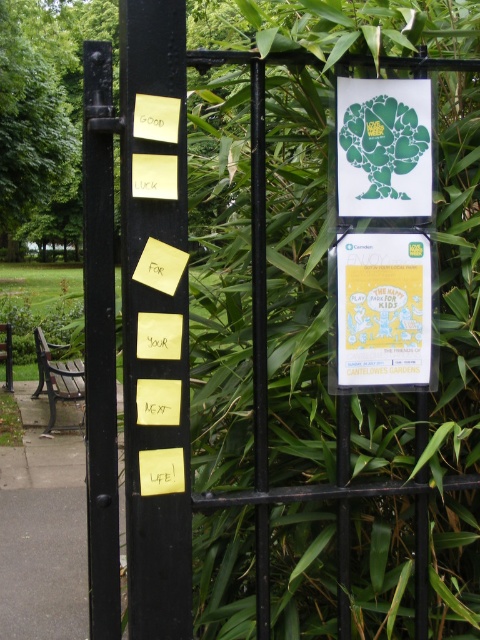
Based on the photo, who is taller, wooden bench at lower left or wooden bench at left?

Standing taller between the two is wooden bench at lower left.

Based on the photo, does wooden bench at lower left appear on the left side of wooden bench at left?

Incorrect, wooden bench at lower left is not on the left side of wooden bench at left.

Is point (41, 355) more distant than point (1, 353)?

No, it is not.

The image size is (480, 640). Identify the location of wooden bench at lower left. click(x=57, y=376).

Between black metal post at left and matte paper poster at upper right, which one has more height?

black metal post at left

Does black metal post at left have a lesser height compared to matte paper poster at upper right?

No.

Is point (84, 220) more distant than point (402, 355)?

Yes, it is.

You are a GUI agent. You are given a task and a screenshot of the screen. Output one action in this format:
    pyautogui.click(x=<x>, y=<y>)
    Task: Click on the black metal post at left
    The image size is (480, 640).
    Given the screenshot: What is the action you would take?
    pyautogui.click(x=99, y=342)

In the scene shown: Who is more forward, [409,184] or [4,330]?

Point [409,184]

Does point (429, 104) come farther from viewer compared to point (9, 332)?

No, it is in front of (9, 332).

Identify the location of green paper/plastic tree at upper center. The image size is (480, 640). (384, 147).